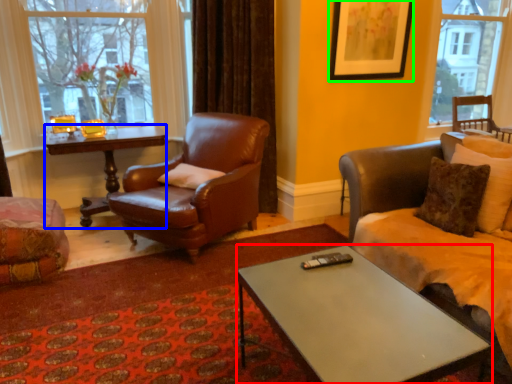
Question: Estimate the real-world distances between objects in this image. Which object is farther from coffee table (highlighted by a red box), desk (highlighted by a blue box) or picture frame (highlighted by a green box)?

Choices:
 (A) desk
 (B) picture frame

Answer: (A)